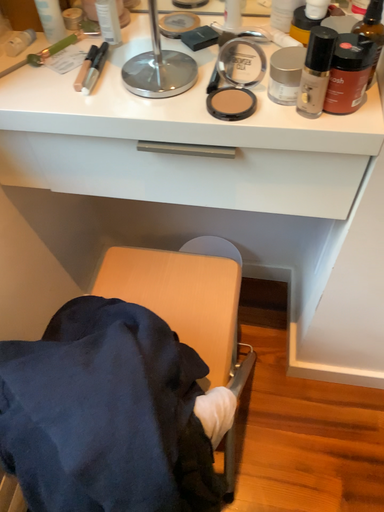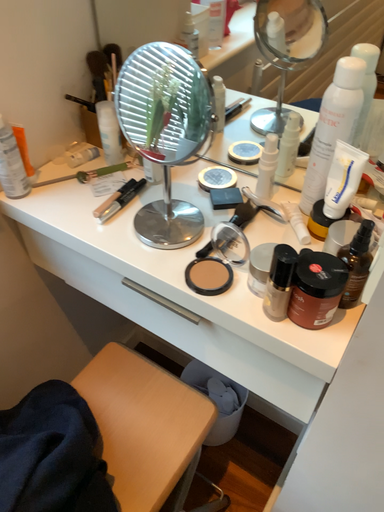
Question: How did the camera likely rotate when shooting the video?

Choices:
 (A) rotated downward
 (B) rotated upward

Answer: (B)